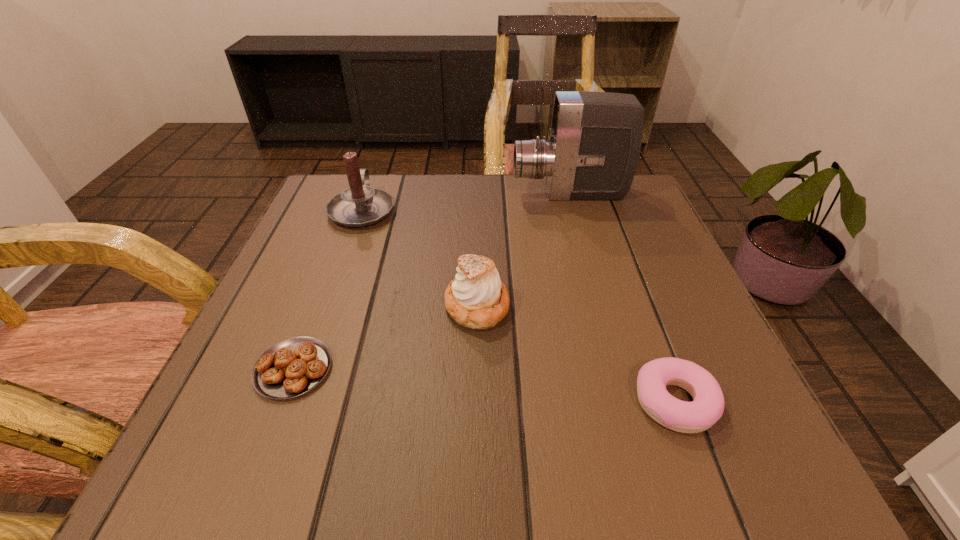
You are a GUI agent. You are given a task and a screenshot of the screen. Output one action in this format:
    pyautogui.click(x=<x>, y=<y>)
    Task: Click on the candle at the left edge
    The width and height of the screenshot is (960, 540).
    Given the screenshot: What is the action you would take?
    click(359, 205)

Find the location of a particular element. This screenshot has width=960, height=540. pastry located at the left edge is located at coordinates (292, 367).

Where is `camcorder that is positioned at the right edge`? camcorder that is positioned at the right edge is located at coordinates (x=594, y=143).

The height and width of the screenshot is (540, 960). In order to click on pastry that is at the right edge in this screenshot , I will do `click(699, 415)`.

The image size is (960, 540). I want to click on object situated at the far left corner, so click(359, 205).

This screenshot has height=540, width=960. Identify the location of object present at the far right corner. (594, 143).

Identify the location of object that is at the near right corner. (699, 415).

This screenshot has height=540, width=960. Identify the location of vacant space at the far edge of the desktop. (515, 199).

In the image, there is a desktop. Identify the location of vacant space at the near edge. The image size is (960, 540). click(x=469, y=451).

Locate an element on the screen. Image resolution: width=960 pixels, height=540 pixels. vacant space at the left edge of the desktop is located at coordinates (209, 394).